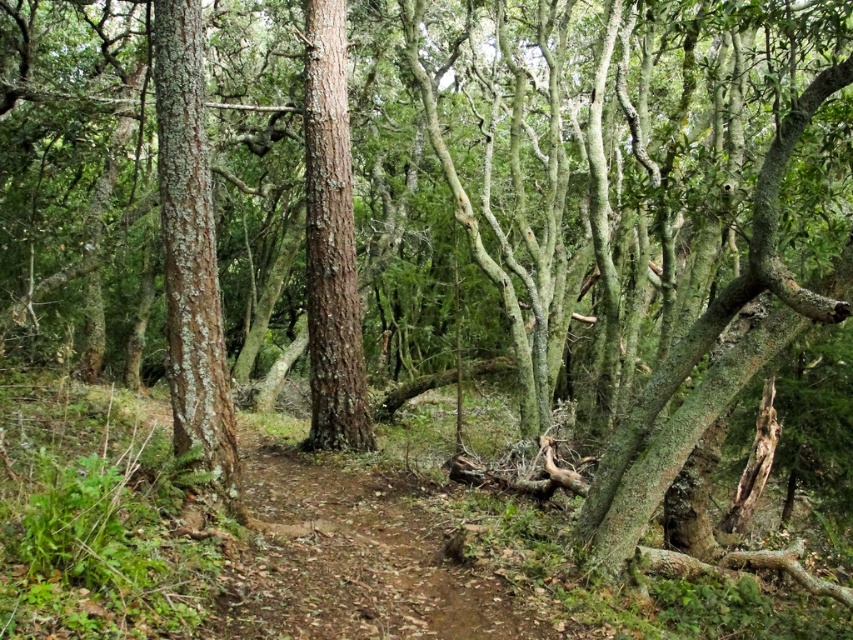
Question: Does green lichen-covered tree trunk at center-left appear over smooth brown tree trunk at center?

Choices:
 (A) yes
 (B) no

Answer: (B)

Question: From the image, what is the correct spatial relationship of green lichen-covered tree trunk at center-left in relation to smooth brown tree trunk at center?

Choices:
 (A) below
 (B) above

Answer: (A)

Question: Which point is closer to the camera taking this photo?

Choices:
 (A) (212, 401)
 (B) (311, 170)

Answer: (A)

Question: Among these objects, which one is nearest to the camera?

Choices:
 (A) green lichen-covered tree trunk at center-left
 (B) smooth brown tree trunk at center

Answer: (A)

Question: Is green lichen-covered tree trunk at center-left above smooth brown tree trunk at center?

Choices:
 (A) no
 (B) yes

Answer: (A)